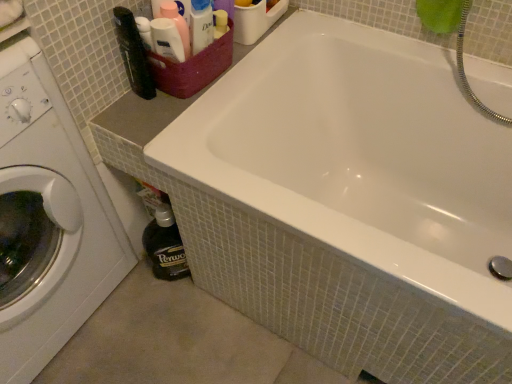
Question: Based on their positions, is white glossy bathtub at upper center located to the left or right of white glossy washing machine at left?

Choices:
 (A) left
 (B) right

Answer: (B)

Question: From their relative heights in the image, would you say white glossy bathtub at upper center is taller or shorter than white glossy washing machine at left?

Choices:
 (A) short
 (B) tall

Answer: (A)

Question: Estimate the real-world distances between objects in this image. Which object is closer to the white glossy bathtub at upper center?

Choices:
 (A) maroon woven basket at upper left
 (B) white glossy washing machine at left

Answer: (A)

Question: Based on their relative distances, which object is farther from the white glossy bathtub at upper center?

Choices:
 (A) white glossy washing machine at left
 (B) maroon woven basket at upper left

Answer: (A)